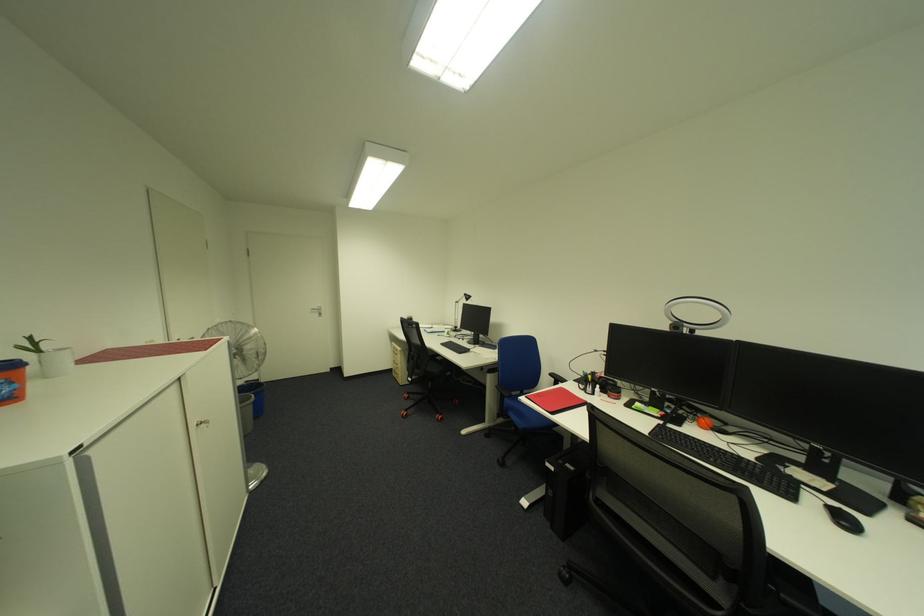
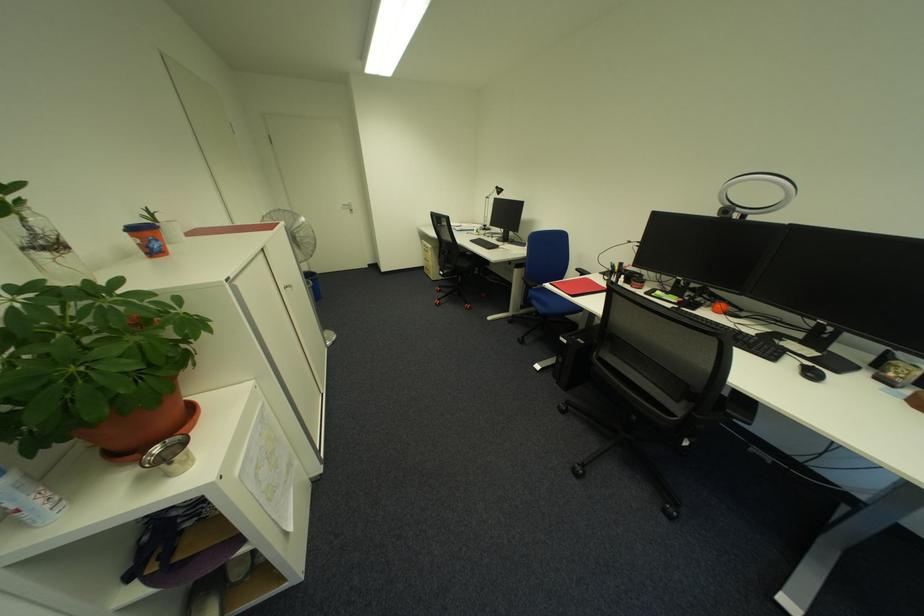
Where in the second image is the point corresponding to point (517, 402) from the first image?

(541, 293)